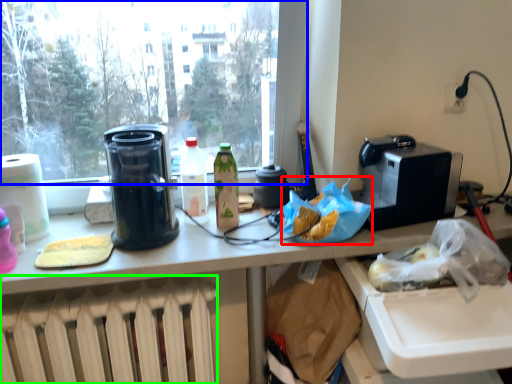
Question: Based on their relative distances, which object is nearer to food (highlighted by a red box)? Choose from window (highlighted by a blue box) and heater (highlighted by a green box).

Choices:
 (A) window
 (B) heater

Answer: (B)